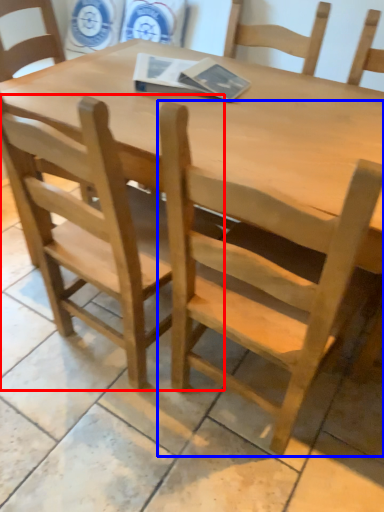
Question: Which of the following is the closest to the observer, chair (highlighted by a red box) or chair (highlighted by a blue box)?

Choices:
 (A) chair
 (B) chair

Answer: (B)